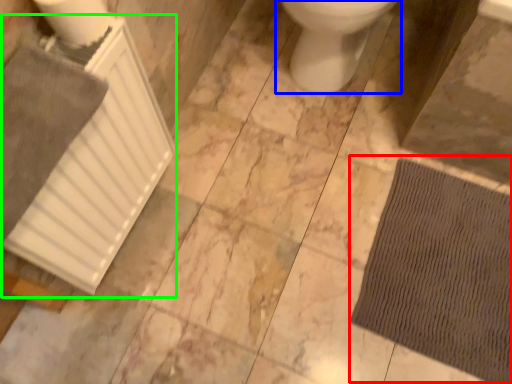
Question: Which is nearer to the doormat (highlighted by a red box)? toilet (highlighted by a blue box) or radiator (highlighted by a green box).

Choices:
 (A) toilet
 (B) radiator

Answer: (A)